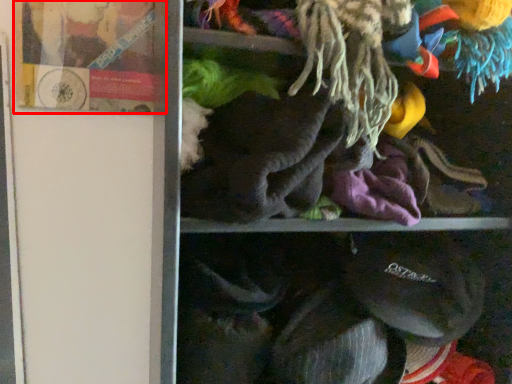
Question: Observing the image, what is the correct spatial positioning of book (annotated by the red box) in reference to laundry?

Choices:
 (A) left
 (B) right

Answer: (A)